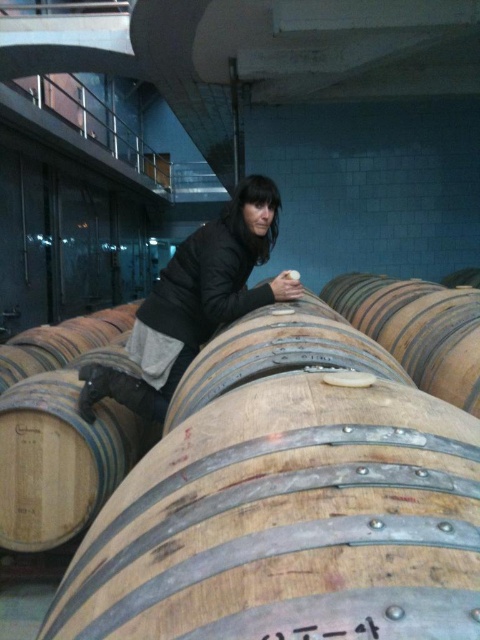
Question: Is brown wooden barrel at center positioned behind dark gray jacket at center?

Choices:
 (A) no
 (B) yes

Answer: (A)

Question: In this image, where is brown wooden barrel at center located relative to dark gray jacket at center?

Choices:
 (A) right
 (B) left

Answer: (A)

Question: Is brown wooden barrel at center smaller than dark gray jacket at center?

Choices:
 (A) yes
 (B) no

Answer: (A)

Question: Which object is the closest to the brown wooden barrel at center?

Choices:
 (A) light brown wooden barrel at center
 (B) dark gray jacket at center

Answer: (B)

Question: Estimate the real-world distances between objects in this image. Which object is closer to the brown wooden barrel at center?

Choices:
 (A) dark gray jacket at center
 (B) light brown wooden barrel at center

Answer: (A)

Question: Which object appears farthest from the camera in this image?

Choices:
 (A) light brown wooden barrel at center
 (B) brown wooden barrel at center
 (C) dark gray jacket at center

Answer: (C)